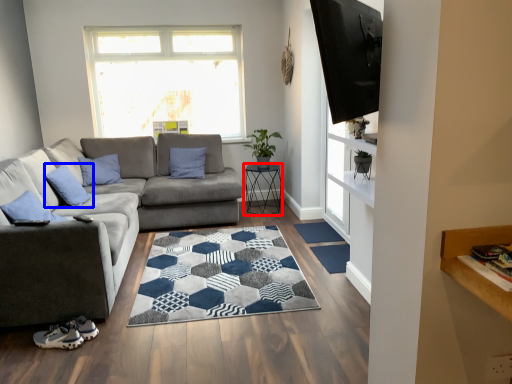
Question: Which point is further to the camera, table (highlighted by a red box) or pillow (highlighted by a blue box)?

Choices:
 (A) table
 (B) pillow

Answer: (A)